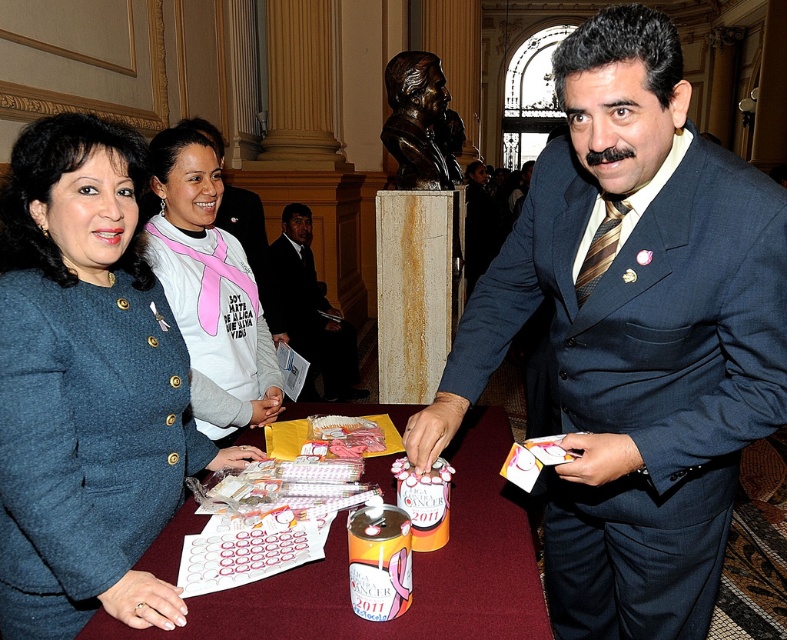
Question: Is pink fabric shirt at center positioned at the back of dark suit at center?

Choices:
 (A) no
 (B) yes

Answer: (A)

Question: Among these objects, which one is nearest to the camera?

Choices:
 (A) pink fabric shirt at center
 (B) matte blue coat at center

Answer: (B)

Question: Which point appears farthest from the camera in this image?

Choices:
 (A) coord(318,321)
 (B) coord(250,209)

Answer: (A)

Question: Can you confirm if pink fabric shirt at center is thinner than dark suit at center?

Choices:
 (A) no
 (B) yes

Answer: (B)

Question: Among these objects, which one is farthest from the camera?

Choices:
 (A) dark suit at center
 (B) matte blue coat at center

Answer: (A)

Question: Is dark suit at center smaller than matte black suit at center?

Choices:
 (A) yes
 (B) no

Answer: (B)